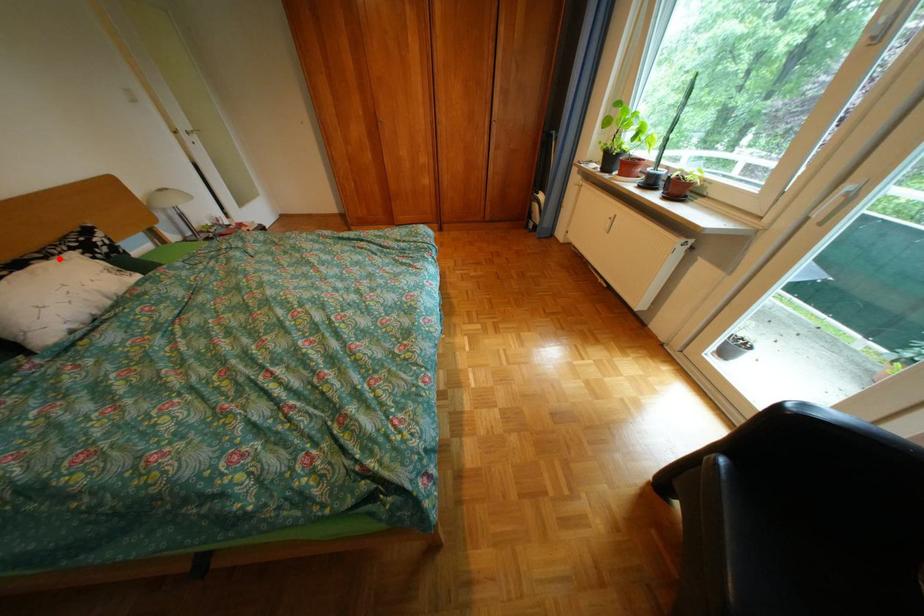
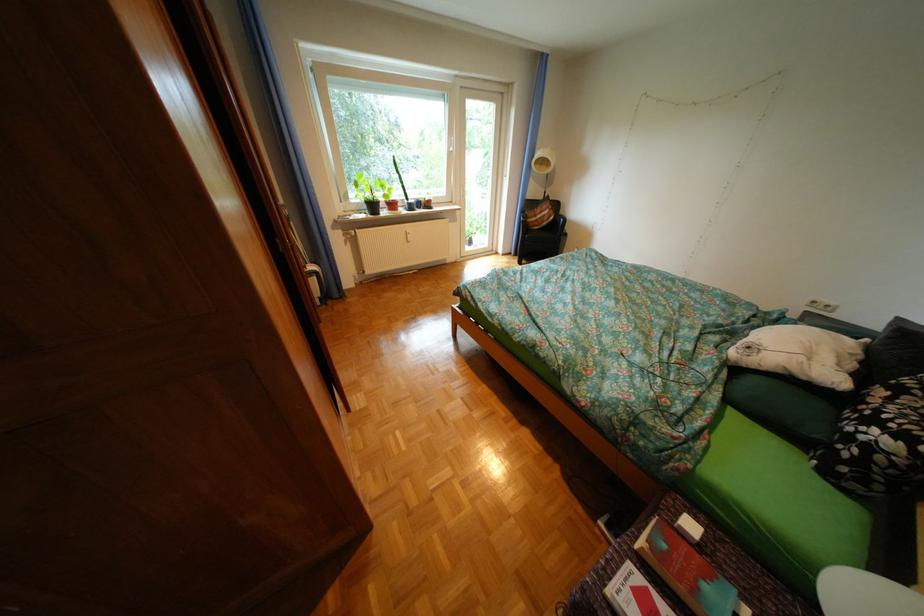
Question: A red point is marked in image1. In image2, is the corresponding 3D point closer to the camera or farther? Reply with the corresponding letter.

Choices:
 (A) The corresponding 3D point is closer.
 (B) The corresponding 3D point is farther.

Answer: (A)